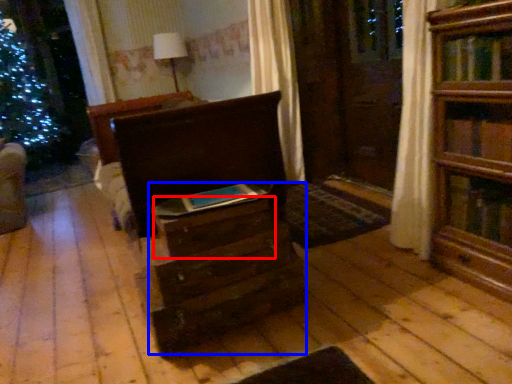
Question: Which object is closer to the camera taking this photo, drawer (highlighted by a red box) or drawer (highlighted by a blue box)?

Choices:
 (A) drawer
 (B) drawer

Answer: (B)